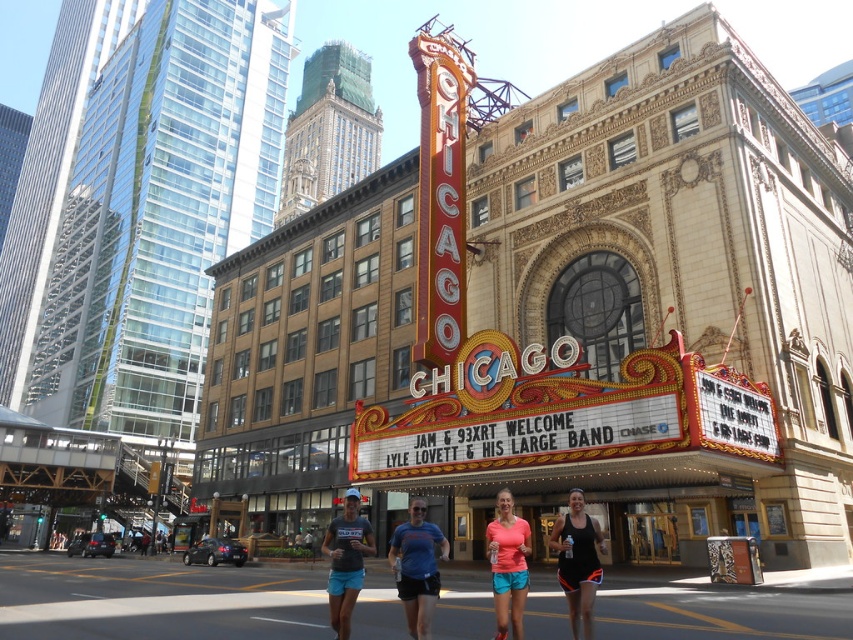
Question: Considering the real-world distances, which object is closest to the matte coral tank top at center?

Choices:
 (A) dark gray matte t-shirt at center
 (B) gold ornate theater at center

Answer: (A)

Question: Which point appears farthest from the camera in this image?

Choices:
 (A) 514,556
 (B) 567,593
 (C) 782,252
 (D) 428,552

Answer: (C)

Question: Which point appears closest to the camera in this image?

Choices:
 (A) (792, 268)
 (B) (578, 616)

Answer: (B)

Question: Is gold ornate theater at center to the right of blue fabric shirt at center from the viewer's perspective?

Choices:
 (A) yes
 (B) no

Answer: (A)

Question: In this image, where is blue fabric shirt at center located relative to matte coral tank top at center?

Choices:
 (A) right
 (B) left

Answer: (B)

Question: Does black matte tank top at center have a smaller size compared to dark gray matte t-shirt at center?

Choices:
 (A) yes
 (B) no

Answer: (A)